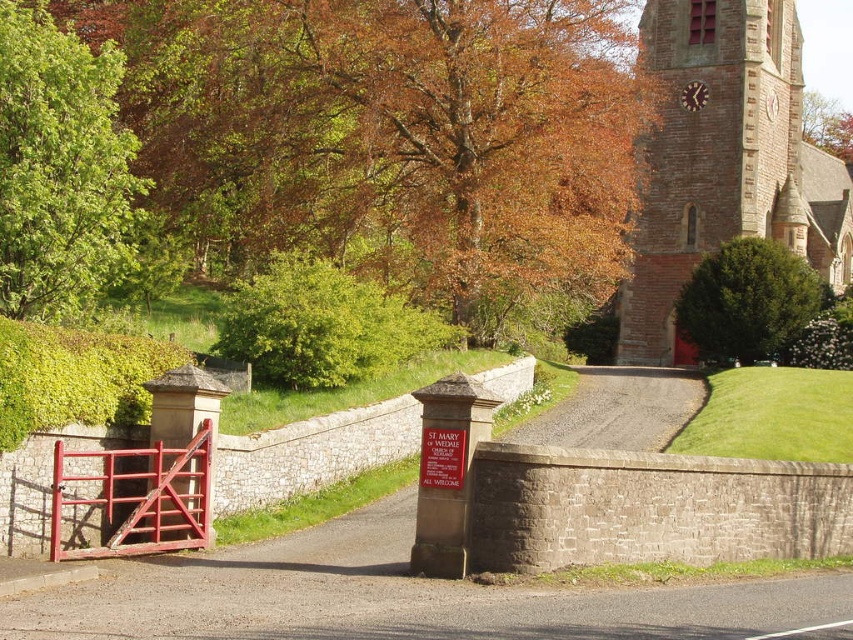
You are a visitor at the church and want to take a photo of the green leafy bush at upper right and the brown textured tree at upper right. Which one appears narrower in the photo?

The green leafy bush at upper right is thinner than the brown textured tree at upper right, so it will appear narrower in the photo.

You are a visitor approaching the red metal gate with a crossbar at the entrance. You notice two trees in the distance. Which tree is wider between the green leafy tree at upper left and the brown textured tree at upper right?

The brown textured tree at upper right is wider than the green leafy tree at upper left.